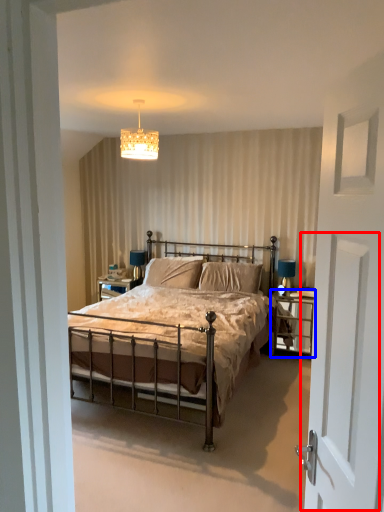
Question: Which object is closer to the camera taking this photo, screen door (highlighted by a red box) or nightstand (highlighted by a blue box)?

Choices:
 (A) screen door
 (B) nightstand

Answer: (A)